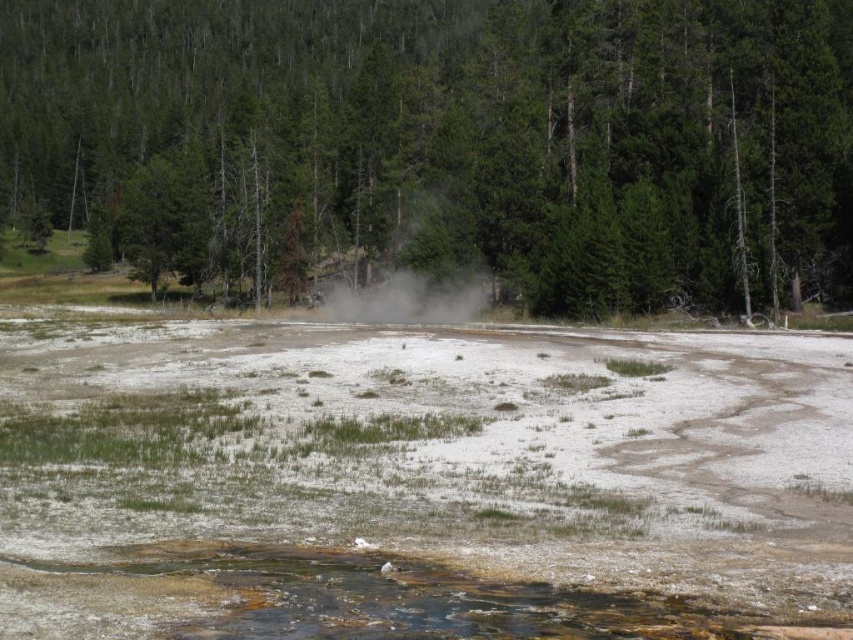
You are standing at the point marked as point (288, 48) in the geothermal area. You want to walk towards the point marked as point (155, 445). Which direction should you move first?

You should move towards the point (155, 445) first since it is closer to you than point (288, 48).

You are standing at the edge of the geothermal area and see two points marked in the image. Which of these points, point (113, 621) or point (389, 284), is closer to you?

Point (113, 621) is closer to the viewer than point (389, 284).